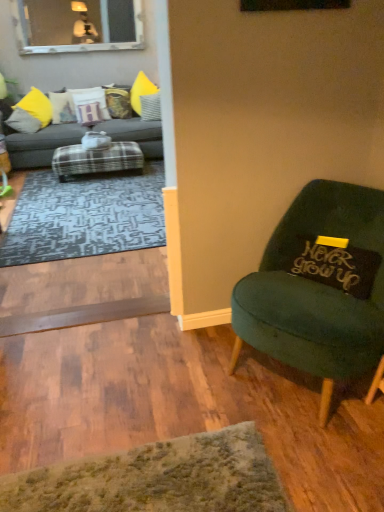
Question: Considering the relative sizes of clear glass window at upper left and velvet green chair at right in the image provided, is clear glass window at upper left wider than velvet green chair at right?

Choices:
 (A) no
 (B) yes

Answer: (A)

Question: From a real-world perspective, does clear glass window at upper left sit lower than velvet green chair at right?

Choices:
 (A) yes
 (B) no

Answer: (B)

Question: Is clear glass window at upper left oriented towards velvet green chair at right?

Choices:
 (A) no
 (B) yes

Answer: (B)

Question: Can you confirm if clear glass window at upper left is smaller than velvet green chair at right?

Choices:
 (A) yes
 (B) no

Answer: (A)

Question: Does clear glass window at upper left have a greater height compared to velvet green chair at right?

Choices:
 (A) no
 (B) yes

Answer: (A)

Question: Based on their positions, is velvet yellow pillow at center, which is counted as the fourth pillow, starting from the left, located to the left or right of velvet green chair at right?

Choices:
 (A) right
 (B) left

Answer: (B)

Question: Is velvet yellow pillow at center, the 1th pillow in the back-to-front sequence, inside the boundaries of velvet green chair at right, or outside?

Choices:
 (A) inside
 (B) outside

Answer: (B)

Question: From their relative heights in the image, would you say velvet yellow pillow at center, which is counted as the fourth pillow, starting from the left, is taller or shorter than velvet green chair at right?

Choices:
 (A) short
 (B) tall

Answer: (A)

Question: Is velvet yellow pillow at center, the 3th pillow from the right, wider or thinner than velvet green chair at right?

Choices:
 (A) wide
 (B) thin

Answer: (B)

Question: Looking at their shapes, would you say velvet yellow pillow at center, which is counted as the 6th pillow, starting from the bottom, is wider or thinner than clear glass window at upper left?

Choices:
 (A) thin
 (B) wide

Answer: (B)

Question: Relative to clear glass window at upper left, is velvet yellow pillow at center, which is counted as the 6th pillow, starting from the bottom, in front or behind?

Choices:
 (A) front
 (B) behind

Answer: (B)

Question: From a real-world perspective, is velvet yellow pillow at center, which is counted as the 6th pillow, starting from the bottom, above or below clear glass window at upper left?

Choices:
 (A) below
 (B) above

Answer: (A)

Question: Is velvet yellow pillow at center, which is counted as the fourth pillow, starting from the left, inside the boundaries of clear glass window at upper left, or outside?

Choices:
 (A) outside
 (B) inside

Answer: (A)

Question: Based on their positions, is black fabric pillow at right, arranged as the 1th pillow when viewed from the front, located to the left or right of matte yellow pillow at left, which appears as the second pillow when ordered from the bottom?

Choices:
 (A) left
 (B) right

Answer: (B)

Question: Considering their positions, is black fabric pillow at right, the first pillow when ordered from right to left, located in front of or behind matte yellow pillow at left, which ranks as the sixth pillow in right-to-left order?

Choices:
 (A) behind
 (B) front

Answer: (B)